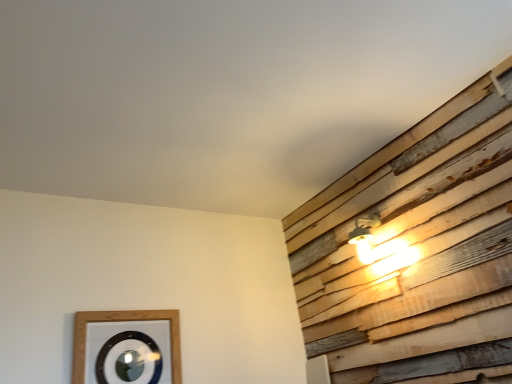
Find the location of a particular element. This screenshot has width=512, height=384. wooden picture frame at lower left is located at coordinates (127, 347).

Describe the element at coordinates (127, 347) in the screenshot. I see `wooden picture frame at lower left` at that location.

At what (x,y) coordinates should I click in order to perform the action: click on wooden picture frame at lower left. Please return your answer as a coordinate pair (x, y). Looking at the image, I should click on (127, 347).